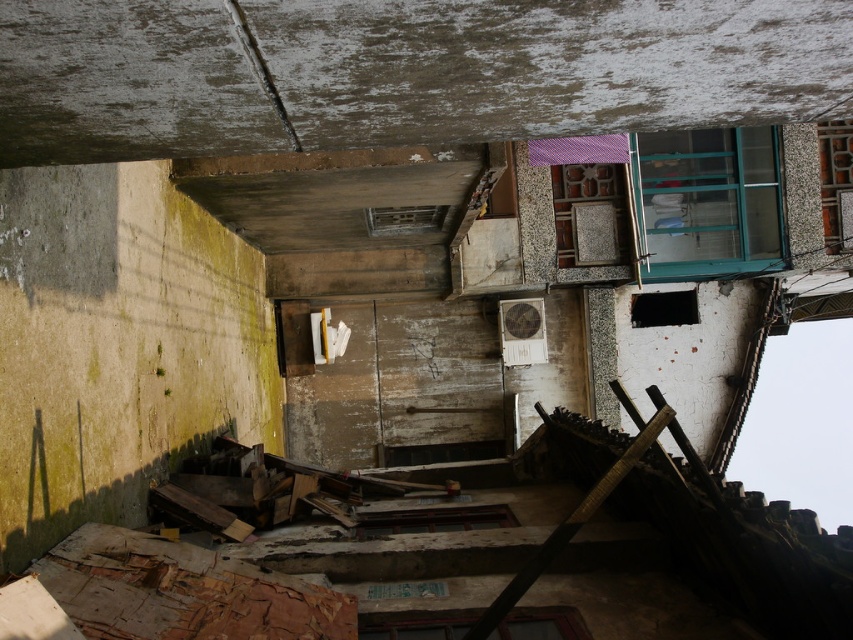
Does point (741, 200) come behind point (415, 628)?

Yes, point (741, 200) is behind point (415, 628).

Image resolution: width=853 pixels, height=640 pixels. Describe the element at coordinates (708, 202) in the screenshot. I see `green glass window at upper right` at that location.

From the picture: Who is more forward, (741, 148) or (556, 624)?

Point (556, 624) is in front.

This screenshot has height=640, width=853. I want to click on green glass window at upper right, so click(708, 202).